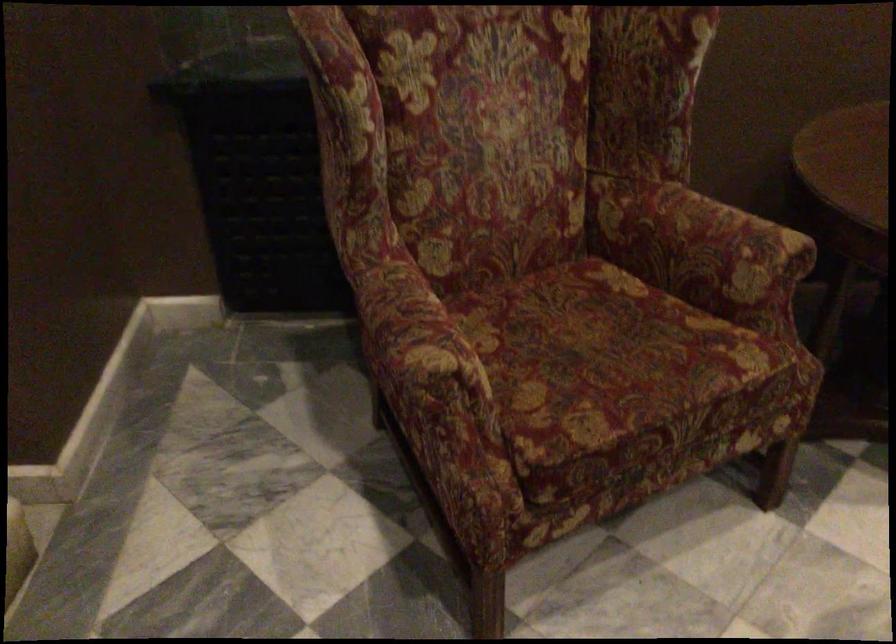
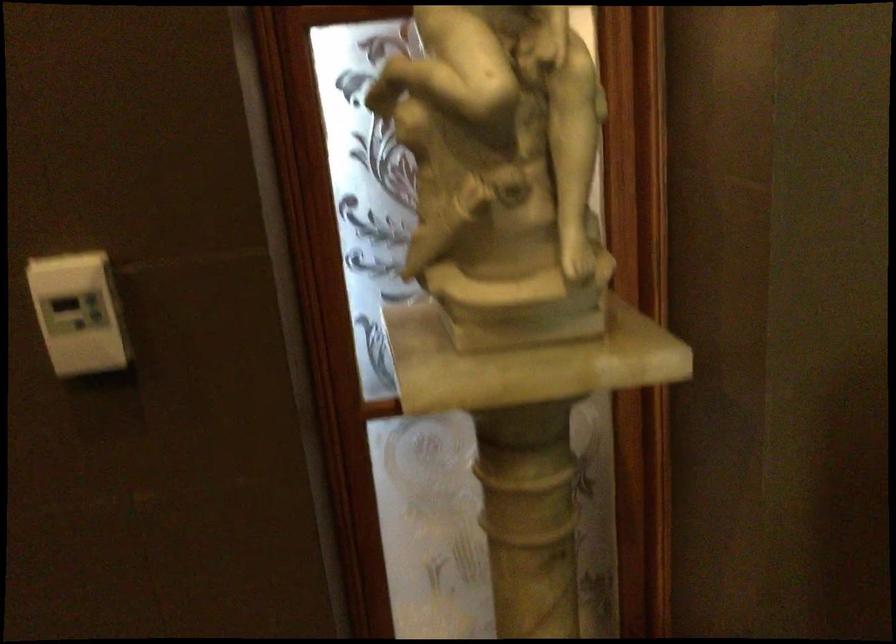
Question: How did the camera likely rotate?

Choices:
 (A) Left
 (B) Right
 (C) Up
 (D) Down

Answer: (A)